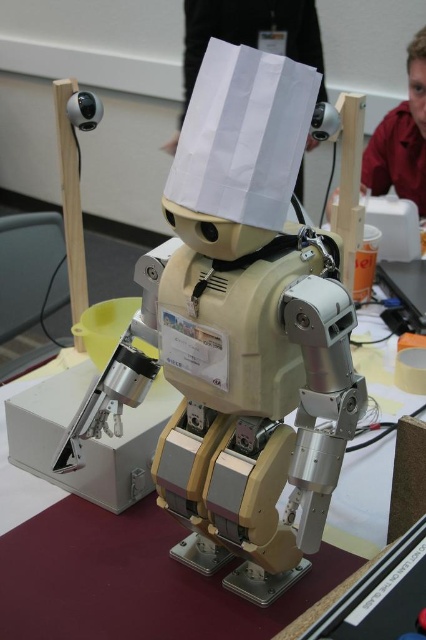
Who is higher up, metallic silver table at center or red shirt at upper right?

red shirt at upper right

Is metallic silver table at center below red shirt at upper right?

Yes.

Identify the location of metallic silver table at center. This screenshot has width=426, height=640. (163, 541).

Who is more forward, (287, 17) or (411, 45)?

Point (411, 45) is more forward.

Can you confirm if white paper at upper center is positioned to the right of red shirt at upper right?

No, white paper at upper center is not to the right of red shirt at upper right.

Locate an element on the screen. The height and width of the screenshot is (640, 426). white paper at upper center is located at coordinates (252, 33).

Find the location of `white paper at upper center`. white paper at upper center is located at coordinates (252, 33).

Who is lower down, metallic silver table at center or white paper at upper center?

metallic silver table at center is below.

Does metallic silver table at center appear over white paper at upper center?

No, metallic silver table at center is not above white paper at upper center.

Where is `metallic silver table at center`? The width and height of the screenshot is (426, 640). metallic silver table at center is located at coordinates (163, 541).

This screenshot has width=426, height=640. I want to click on metallic silver table at center, so click(163, 541).